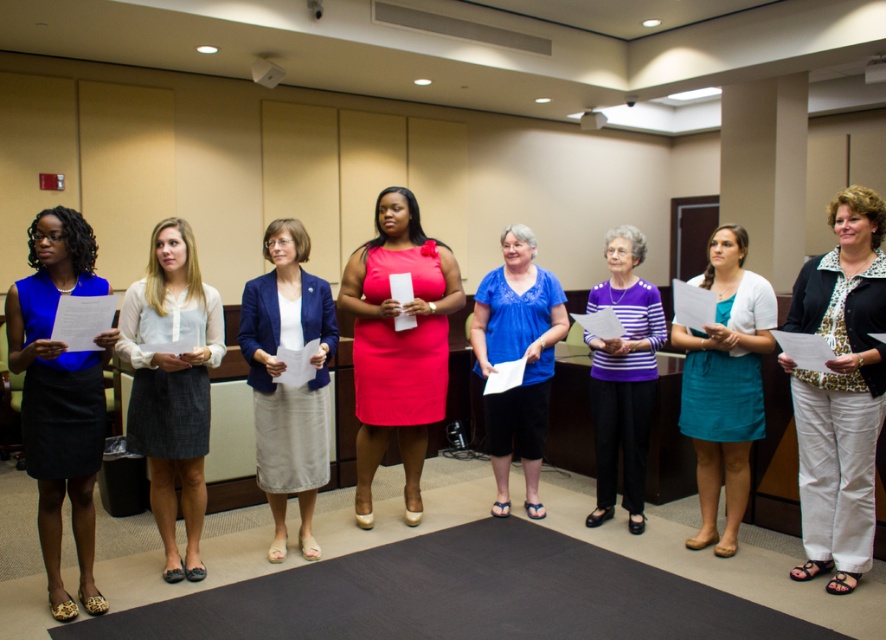
Is point (848, 417) farther from viewer compared to point (688, 372)?

No, it is not.

Which is in front, point (843, 275) or point (731, 452)?

Point (843, 275) is more forward.

This screenshot has height=640, width=886. What are the coordinates of `printed floral blouse at center` in the screenshot? It's located at (840, 390).

Which is more to the left, matte pink dress at center or gray wool skirt at center?

From the viewer's perspective, gray wool skirt at center appears more on the left side.

Can you confirm if matte pink dress at center is positioned above gray wool skirt at center?

Yes.

Describe the element at coordinates (398, 342) in the screenshot. I see `matte pink dress at center` at that location.

I want to click on matte pink dress at center, so click(398, 342).

Who is positioned more to the right, matte blue blouse at left or gray wool skirt at center?

Positioned to the right is gray wool skirt at center.

Where is `matte blue blouse at left`? matte blue blouse at left is located at coordinates (60, 396).

Find the location of `matte blue blouse at left`. matte blue blouse at left is located at coordinates (60, 396).